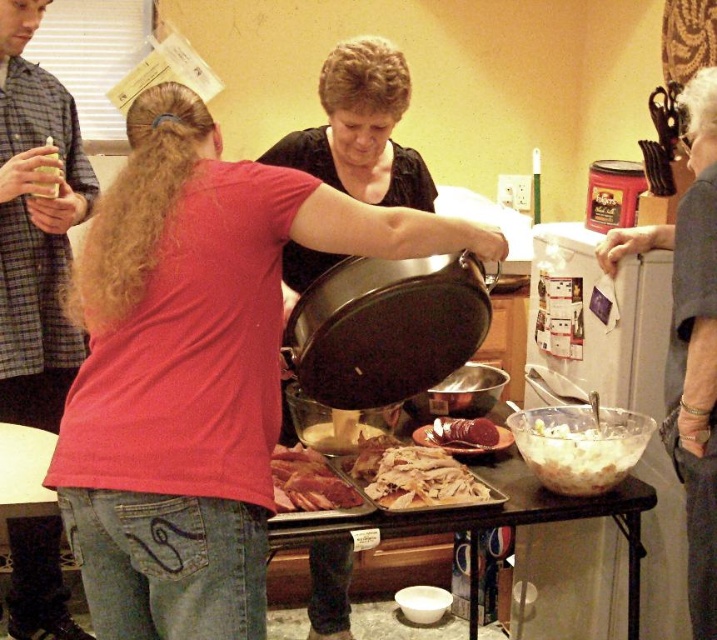
Question: Can you confirm if white matte bowl at lower center is wider than raw pink meat at center?

Choices:
 (A) yes
 (B) no

Answer: (A)

Question: Which point is closer to the camera?

Choices:
 (A) shredded white cheese at center
 (B) brushed metal can at upper left

Answer: (A)

Question: Considering the real-world distances, which object is closest to the shredded white cheese at center?

Choices:
 (A) raw pink meat at center
 (B) black matte frying pan at center

Answer: (A)

Question: Does matte black pan at center have a smaller size compared to translucent plastic cup at upper left?

Choices:
 (A) no
 (B) yes

Answer: (A)

Question: Which point appears farthest from the camera in this image?

Choices:
 (A) (x=455, y=477)
 (B) (x=47, y=193)
 (C) (x=640, y=456)
 (D) (x=0, y=163)

Answer: (D)

Question: Does sliced pink meat at center appear on the left side of translucent plastic cup at upper left?

Choices:
 (A) no
 (B) yes

Answer: (A)